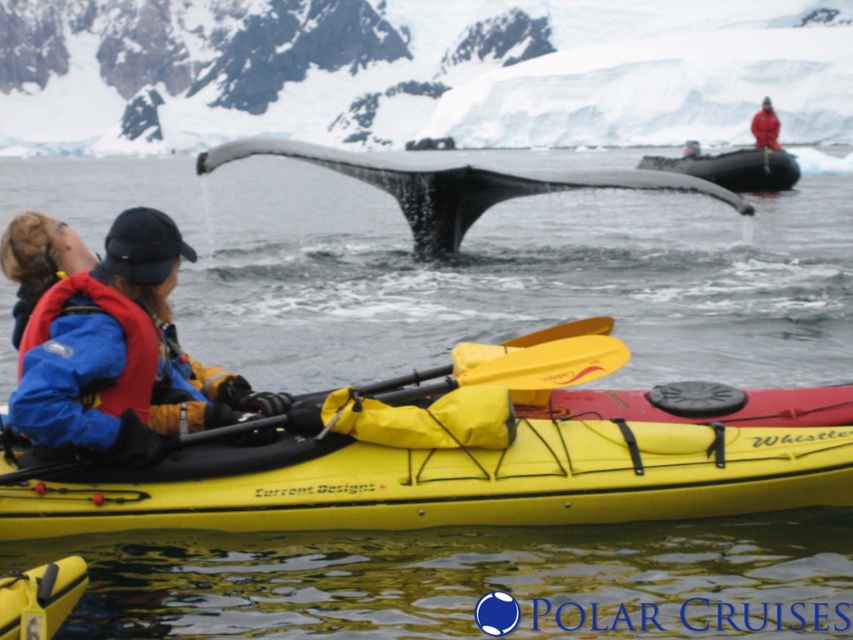
Question: Is gray smooth whale tail at center in front of yellow rubber paddle at center?

Choices:
 (A) yes
 (B) no

Answer: (B)

Question: Which is nearer to the gray smooth whale tail at center?

Choices:
 (A) blue fabric jacket at lower left
 (B) rubber inflatable boat at upper center
 (C) red fleece jacket at upper center

Answer: (B)

Question: Considering the real-world distances, which object is closest to the matte blue life jacket at left?

Choices:
 (A) red fleece jacket at upper center
 (B) yellow matte kayak at lower center
 (C) yellow rubber paddle at center

Answer: (C)

Question: Can you confirm if blue fabric jacket at lower left is positioned to the left of gray smooth whale tail at center?

Choices:
 (A) no
 (B) yes

Answer: (B)

Question: Estimate the real-world distances between objects in this image. Which object is farther from the yellow rubber paddle at center?

Choices:
 (A) blue fabric jacket at lower left
 (B) matte blue life jacket at left

Answer: (B)

Question: Is blue fabric jacket at lower left to the right of gray smooth whale tail at center from the viewer's perspective?

Choices:
 (A) yes
 (B) no

Answer: (B)